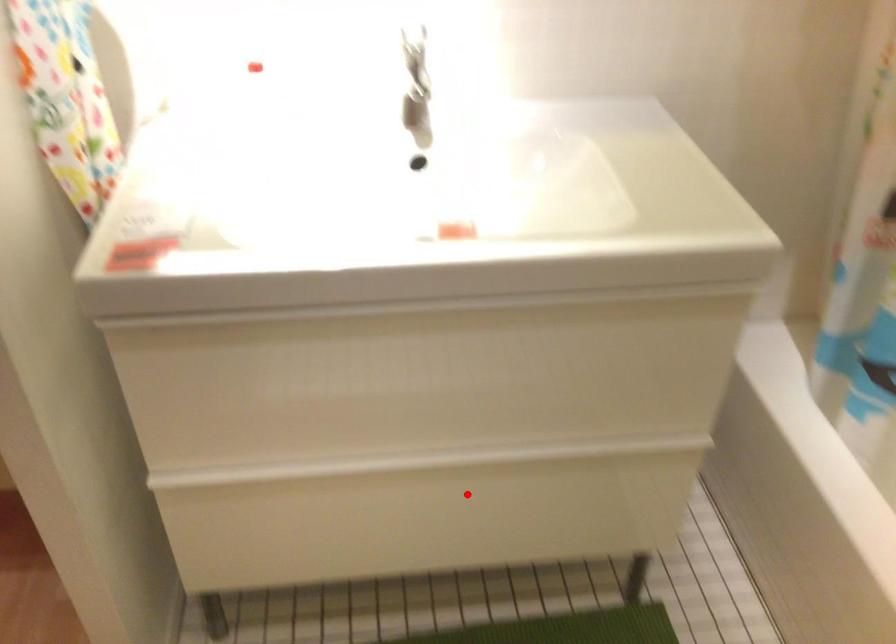
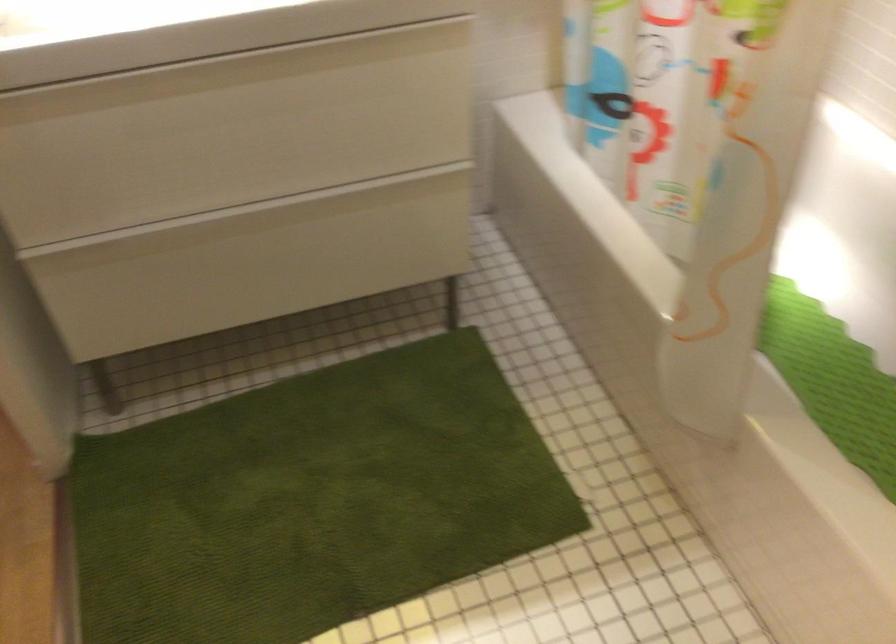
Find the pixel in the second image that matches the highlighted location in the first image.

(289, 238)